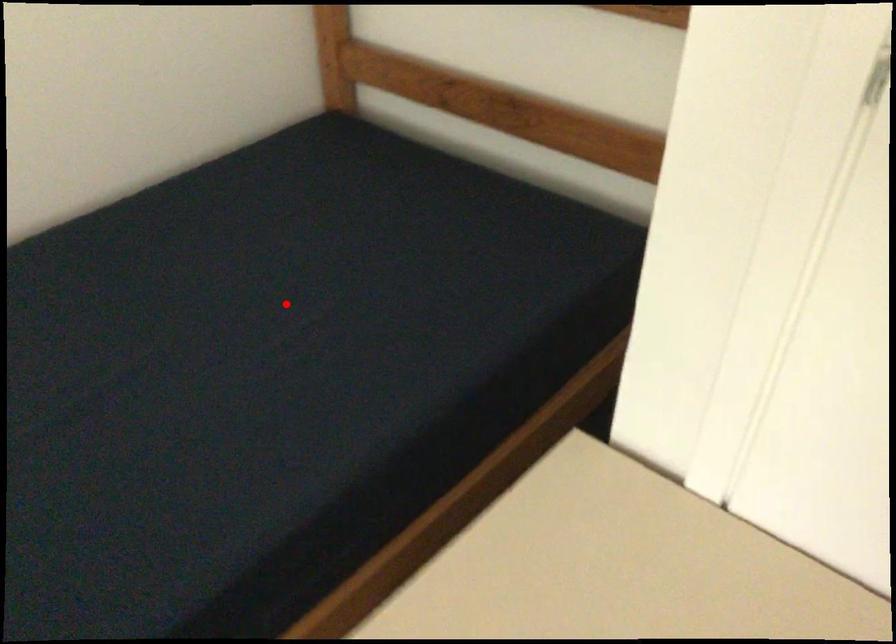
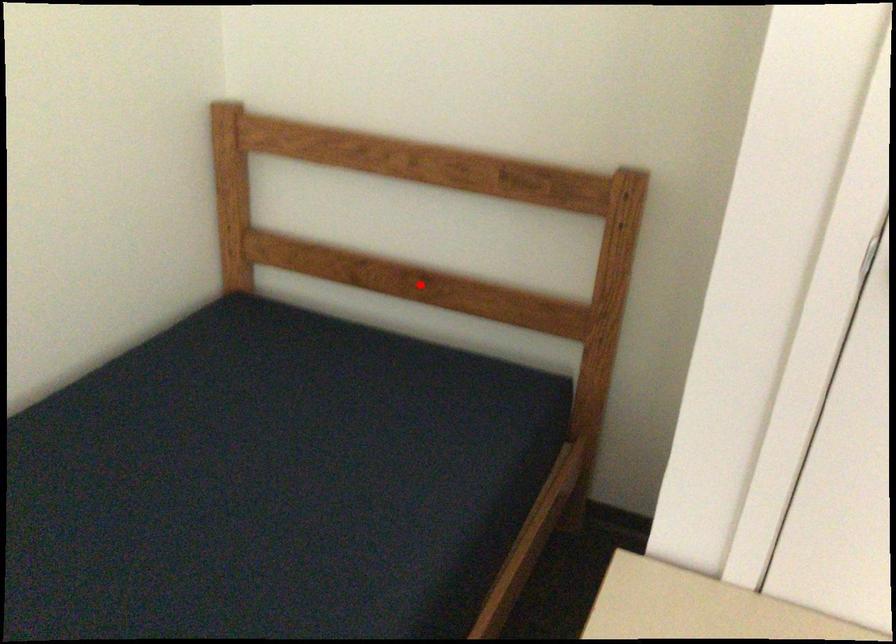
I am providing you with two images of the same scene from different viewpoints. A red point is marked on the first image and another point is marked on the second image. Is the red point in image1 aligned with the point shown in image2?

No